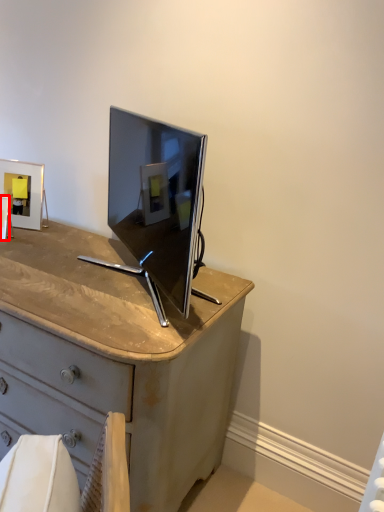
Question: From the image's perspective, where is picture frame (annotated by the red box) located in relation to picture frame in the image?

Choices:
 (A) below
 (B) above

Answer: (A)